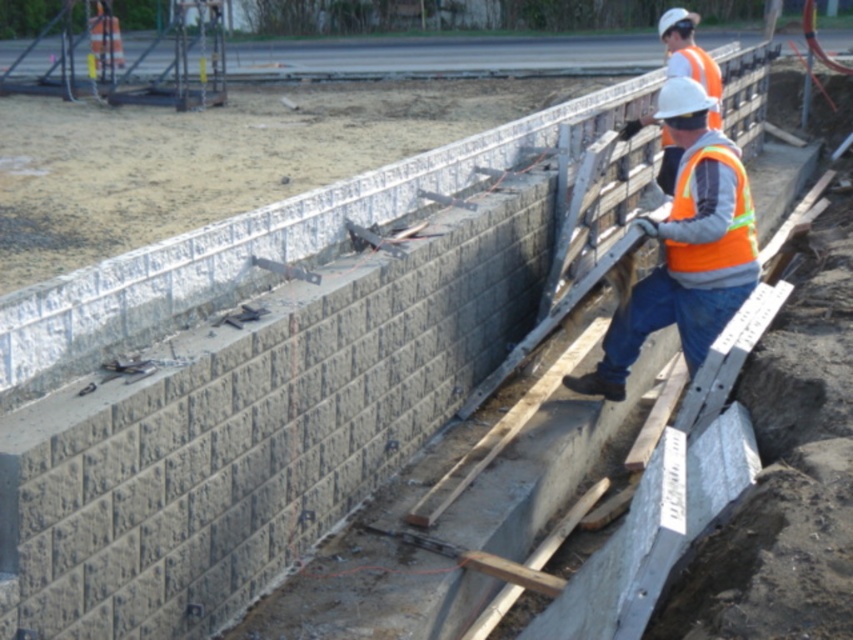
Can you confirm if orange reflective vest at upper right is smaller than orange reflective safety vest at center?

No.

Who is shorter, orange reflective vest at upper right or orange reflective safety vest at center?

Standing shorter between the two is orange reflective safety vest at center.

Identify the location of orange reflective vest at upper right. [686, 248].

Identify the location of orange reflective vest at upper right. The width and height of the screenshot is (853, 640). click(686, 248).